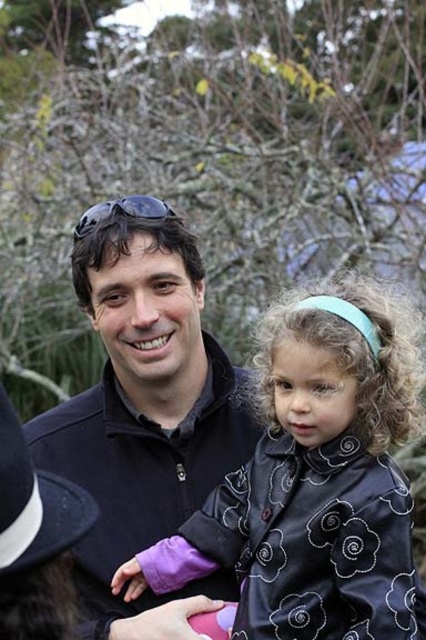
Question: Which point is farther to the camera?

Choices:
 (A) (78, 452)
 (B) (307, 381)

Answer: (A)

Question: Can you confirm if black satin coat at center is thinner than matte black jacket at center?

Choices:
 (A) yes
 (B) no

Answer: (B)

Question: Is black satin coat at center bigger than matte black jacket at center?

Choices:
 (A) no
 (B) yes

Answer: (B)

Question: Does black satin coat at center have a greater width compared to matte black jacket at center?

Choices:
 (A) no
 (B) yes

Answer: (B)